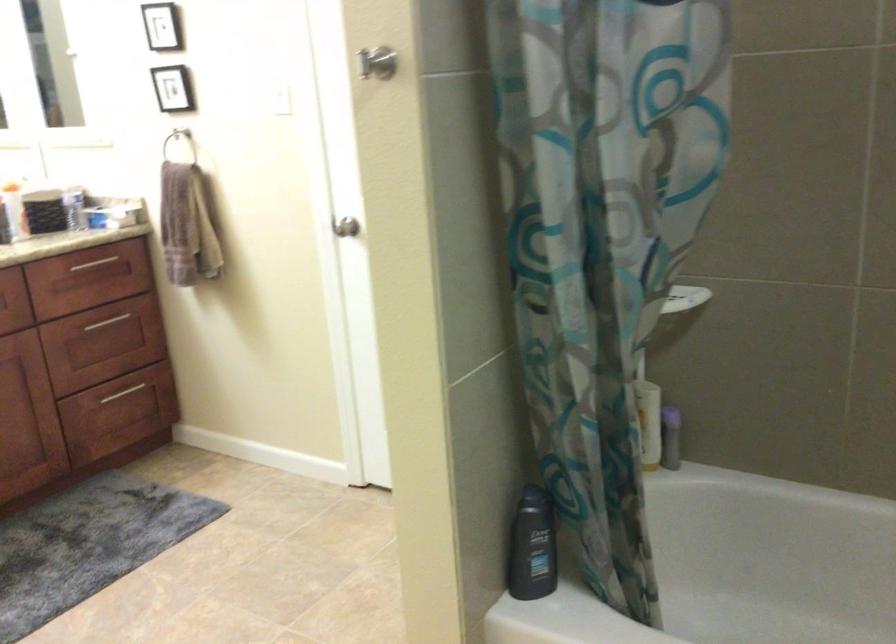
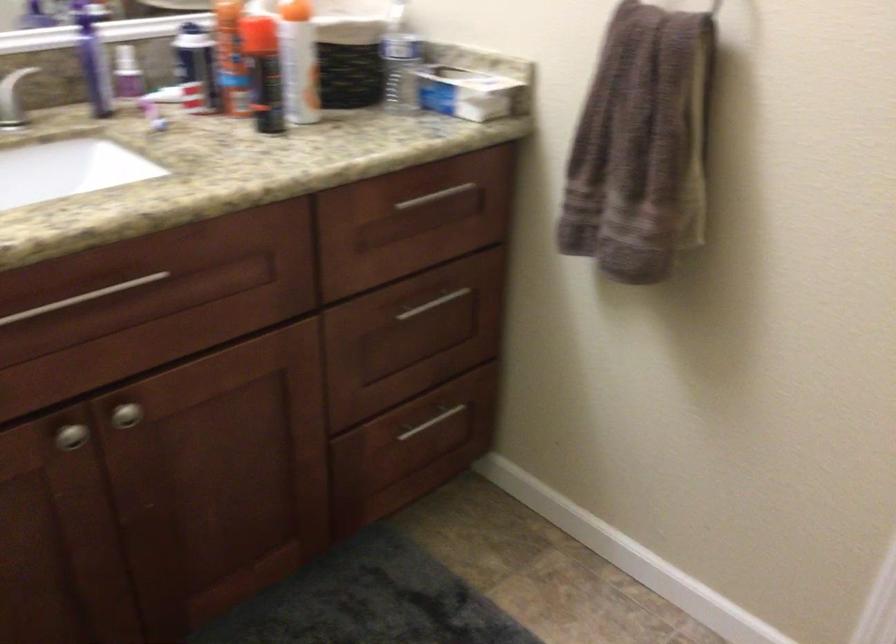
Locate, in the second image, the point that corresponds to the point at 130,391 in the first image.

(432, 422)